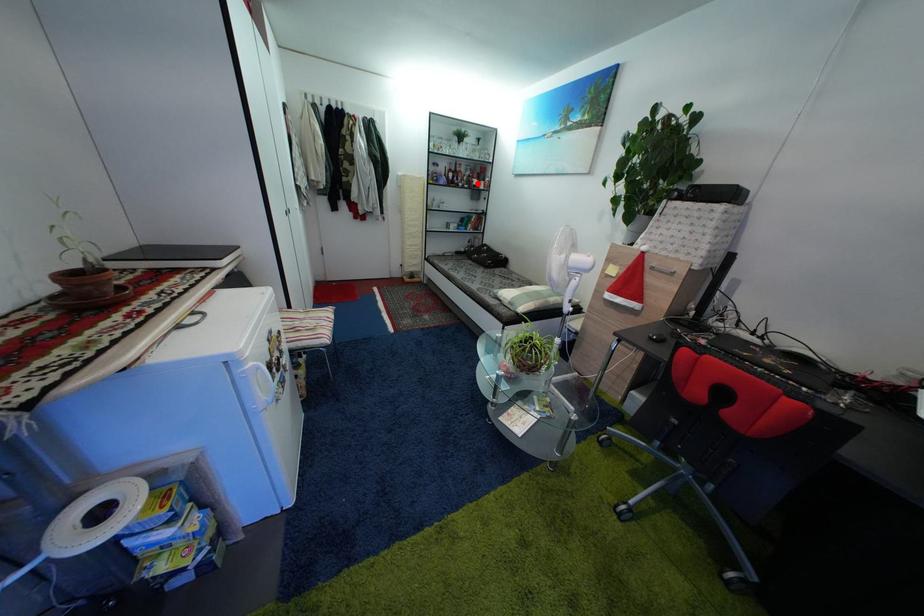
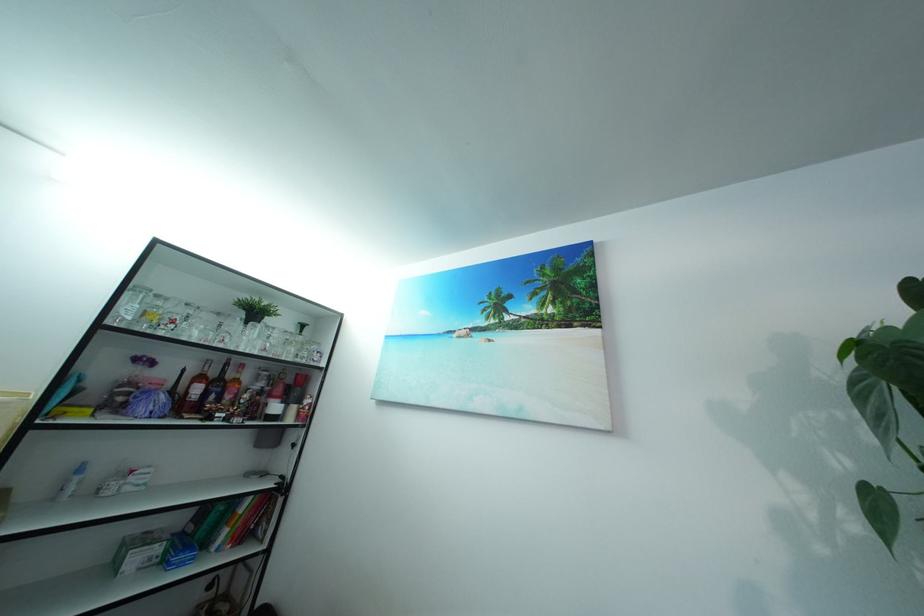
In the second image, find the point that corresponds to the highlighted location in the first image.

(269, 400)